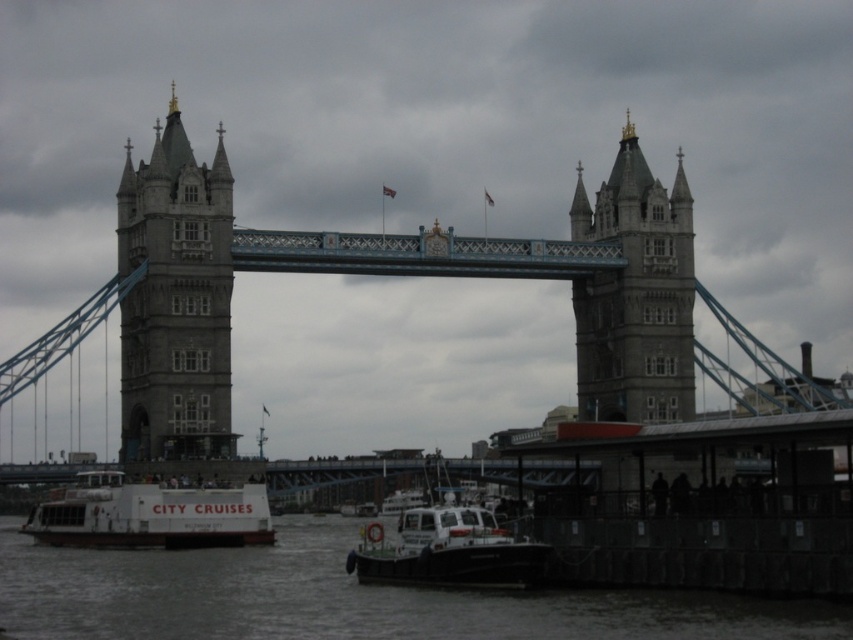
You are standing on the river Thames near the stone tower at left and the white plastic boat at lower center. If you look upward, which object will you see first?

The stone tower at left is located above the white plastic boat at lower center, so you will see the stone tower at left first when looking upward.

You are a tourist standing on the Thames riverbank near Tower Bridge. You see the stone tower at left and the white matte boat at lower left. Which object appears bigger in the scene?

The stone tower at left appears bigger than the white matte boat at lower left because the stone tower at left has a larger size compared to the white matte boat at lower left.

You are standing on the riverbank and see the stone tower at left and the white plastic boat at lower center. Which object is closer to your left side?

The stone tower at left is positioned on the left side of the white plastic boat at lower center, so it is closer to your left side.